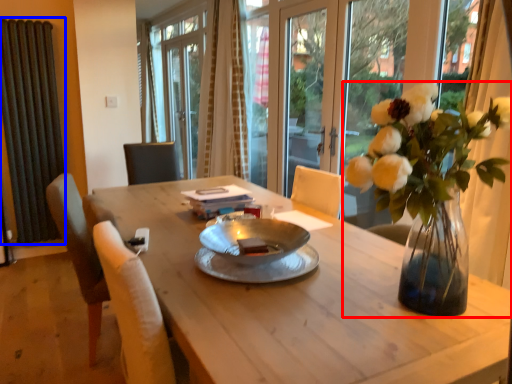
Question: Which of the following is the closest to the observer, houseplant (highlighted by a red box) or radiator (highlighted by a blue box)?

Choices:
 (A) houseplant
 (B) radiator

Answer: (A)